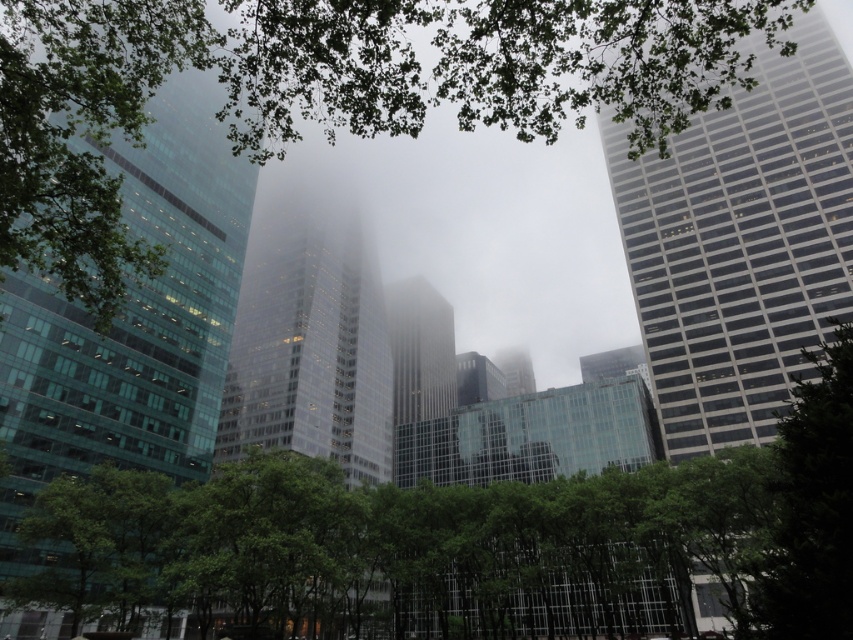
Question: Which object is closer to the camera taking this photo?

Choices:
 (A) green leafy tree at lower left
 (B) green leafy tree at right
 (C) green leafy tree at upper center

Answer: (C)

Question: Does green leafy tree at lower left have a greater width compared to green leafy tree at right?

Choices:
 (A) yes
 (B) no

Answer: (A)

Question: Is green leafy tree at upper center thinner than green leafy tree at lower left?

Choices:
 (A) no
 (B) yes

Answer: (A)

Question: Which point appears farthest from the camera in this image?

Choices:
 (A) (537, 92)
 (B) (173, 547)
 (C) (834, 420)

Answer: (A)

Question: Which object is positioned farthest from the green leafy tree at lower left?

Choices:
 (A) green leafy tree at upper center
 (B) green leafy tree at right

Answer: (A)

Question: Is green leafy tree at upper center positioned in front of green leafy tree at lower left?

Choices:
 (A) no
 (B) yes

Answer: (B)